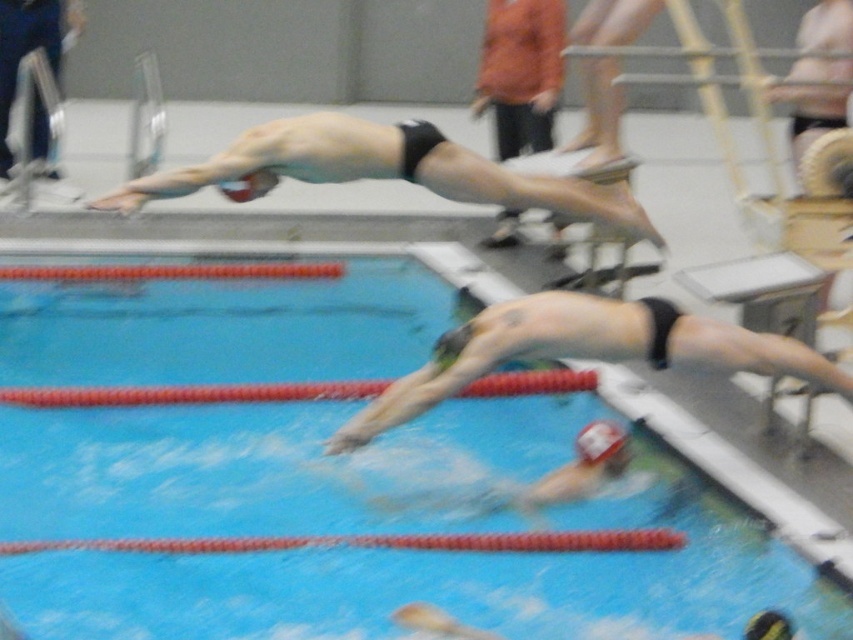
Is blue smooth water at center positioned behind black matte swim cap at upper center?

No.

Does blue smooth water at center appear over black matte swim cap at upper center?

Incorrect, blue smooth water at center is not positioned above black matte swim cap at upper center.

Is point (160, 442) farther from camera compared to point (306, 145)?

Yes, it is.

The height and width of the screenshot is (640, 853). What are the coordinates of `blue smooth water at center` in the screenshot? It's located at (372, 525).

Is blue smooth water at center shorter than matte black swim cap at upper center?

Yes, blue smooth water at center is shorter than matte black swim cap at upper center.

Who is higher up, blue smooth water at center or matte black swim cap at upper center?

matte black swim cap at upper center is above.

What do you see at coordinates (372, 525) in the screenshot?
I see `blue smooth water at center` at bounding box center [372, 525].

In order to click on blue smooth water at center in this screenshot , I will do `click(372, 525)`.

Which is in front, point (322, 509) or point (683, 316)?

Positioned in front is point (322, 509).

What do you see at coordinates (372, 525) in the screenshot? Image resolution: width=853 pixels, height=640 pixels. I see `blue smooth water at center` at bounding box center [372, 525].

Between point (265, 620) and point (781, 348), which one is positioned behind?

Positioned behind is point (781, 348).

The width and height of the screenshot is (853, 640). I want to click on blue smooth water at center, so 372,525.